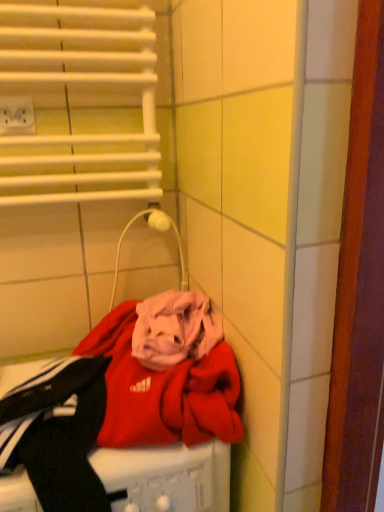
Describe the element at coordinates (17, 116) in the screenshot. The width and height of the screenshot is (384, 512). I see `white plastic outlet at upper left` at that location.

At what (x,y) coordinates should I click in order to perform the action: click on white plastic outlet at upper left. Please return your answer as a coordinate pair (x, y). Looking at the image, I should click on (17, 116).

The height and width of the screenshot is (512, 384). Describe the element at coordinates (166, 478) in the screenshot. I see `red fabric washing machine at lower left` at that location.

The width and height of the screenshot is (384, 512). What are the coordinates of `red fabric washing machine at lower left` in the screenshot? It's located at (166, 478).

What are the coordinates of `white plastic outlet at upper left` in the screenshot? It's located at (17, 116).

Is red fabric washing machine at lower left to the left or to the right of white plastic outlet at upper left in the image?

From the image, it's evident that red fabric washing machine at lower left is to the right of white plastic outlet at upper left.

Is red fabric washing machine at lower left further to the viewer compared to white plastic outlet at upper left?

No.

Does point (143, 480) come closer to viewer compared to point (13, 100)?

Yes, it is.

From the image's perspective, which is above, red fabric washing machine at lower left or white plastic outlet at upper left?

white plastic outlet at upper left is shown above in the image.

From a real-world perspective, between red fabric washing machine at lower left and white plastic outlet at upper left, who is vertically higher?

white plastic outlet at upper left.

Considering the sizes of red fabric washing machine at lower left and white plastic outlet at upper left in the image, is red fabric washing machine at lower left wider or thinner than white plastic outlet at upper left?

Clearly, red fabric washing machine at lower left has more width compared to white plastic outlet at upper left.

In terms of height, does red fabric washing machine at lower left look taller or shorter compared to white plastic outlet at upper left?

Clearly, red fabric washing machine at lower left is taller compared to white plastic outlet at upper left.

Can you confirm if red fabric washing machine at lower left is smaller than white plastic outlet at upper left?

No.

Do you think red fabric washing machine at lower left is within white plastic outlet at upper left, or outside of it?

red fabric washing machine at lower left lies outside white plastic outlet at upper left.

Is red fabric washing machine at lower left not near white plastic outlet at upper left?

No, red fabric washing machine at lower left is not far away from white plastic outlet at upper left.

Is red fabric washing machine at lower left oriented towards white plastic outlet at upper left?

No, red fabric washing machine at lower left is not facing towards white plastic outlet at upper left.

Based on the photo, what's the angular difference between red fabric washing machine at lower left and white plastic outlet at upper left's facing directions?

0.775 degrees.

Where is `washing machine that is under the white plastic outlet at upper left (from a real-world perspective)`? This screenshot has width=384, height=512. washing machine that is under the white plastic outlet at upper left (from a real-world perspective) is located at coordinates (166, 478).

Does white plastic outlet at upper left appear on the right side of red fabric washing machine at lower left?

In fact, white plastic outlet at upper left is to the left of red fabric washing machine at lower left.

From the picture: Which object is further away from the camera, white plastic outlet at upper left or red fabric washing machine at lower left?

white plastic outlet at upper left is further from the camera.

Which is in front, point (18, 129) or point (134, 479)?

Point (134, 479)

From the image's perspective, between white plastic outlet at upper left and red fabric washing machine at lower left, who is located below?

red fabric washing machine at lower left.

From a real-world perspective, who is located higher, white plastic outlet at upper left or red fabric washing machine at lower left?

From a 3D spatial view, white plastic outlet at upper left is above.

Consider the image. Between white plastic outlet at upper left and red fabric washing machine at lower left, which one has larger width?

Wider between the two is red fabric washing machine at lower left.

Between white plastic outlet at upper left and red fabric washing machine at lower left, which one has more height?

With more height is red fabric washing machine at lower left.

Can you confirm if white plastic outlet at upper left is bigger than red fabric washing machine at lower left?

Actually, white plastic outlet at upper left might be smaller than red fabric washing machine at lower left.

Can we say white plastic outlet at upper left lies outside red fabric washing machine at lower left?

Yes, white plastic outlet at upper left is outside of red fabric washing machine at lower left.

Is white plastic outlet at upper left not near red fabric washing machine at lower left?

No, there isn't a large distance between white plastic outlet at upper left and red fabric washing machine at lower left.

Is white plastic outlet at upper left turned away from red fabric washing machine at lower left?

No, red fabric washing machine at lower left is not at the back of white plastic outlet at upper left.

What's the angular difference between white plastic outlet at upper left and red fabric washing machine at lower left's facing directions?

The angle between the facing direction of white plastic outlet at upper left and the facing direction of red fabric washing machine at lower left is 0.775 degrees.

Where is `washing machine in front of the white plastic outlet at upper left`? The height and width of the screenshot is (512, 384). washing machine in front of the white plastic outlet at upper left is located at coordinates (166, 478).

Identify the location of electric outlet that appears behind the red fabric washing machine at lower left. The width and height of the screenshot is (384, 512). (17, 116).

At what (x,y) coordinates should I click in order to perform the action: click on washing machine lying on the right of white plastic outlet at upper left. Please return your answer as a coordinate pair (x, y). The image size is (384, 512). Looking at the image, I should click on (166, 478).